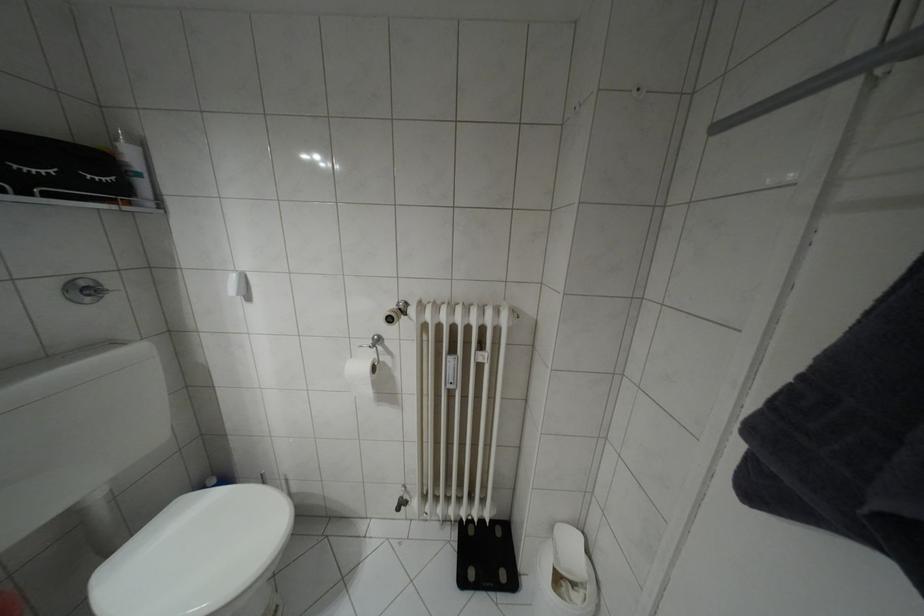
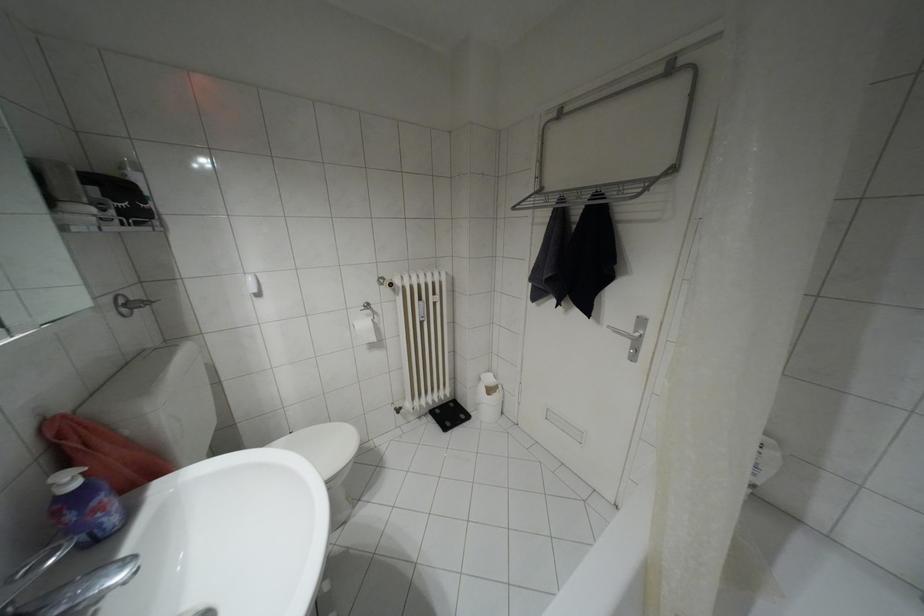
Question: Based on the continuous images, in which direction is the camera rotating? Reply with the corresponding letter.

Choices:
 (A) Left
 (B) Right
 (C) Up
 (D) Down

Answer: (B)